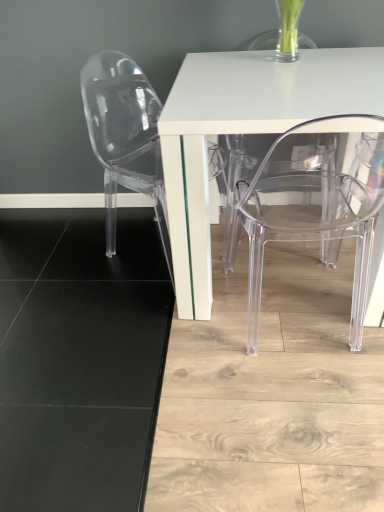
What are the coordinates of `vacant space situated above white glossy table at center (from a real-world perspective)` in the screenshot? It's located at (272, 70).